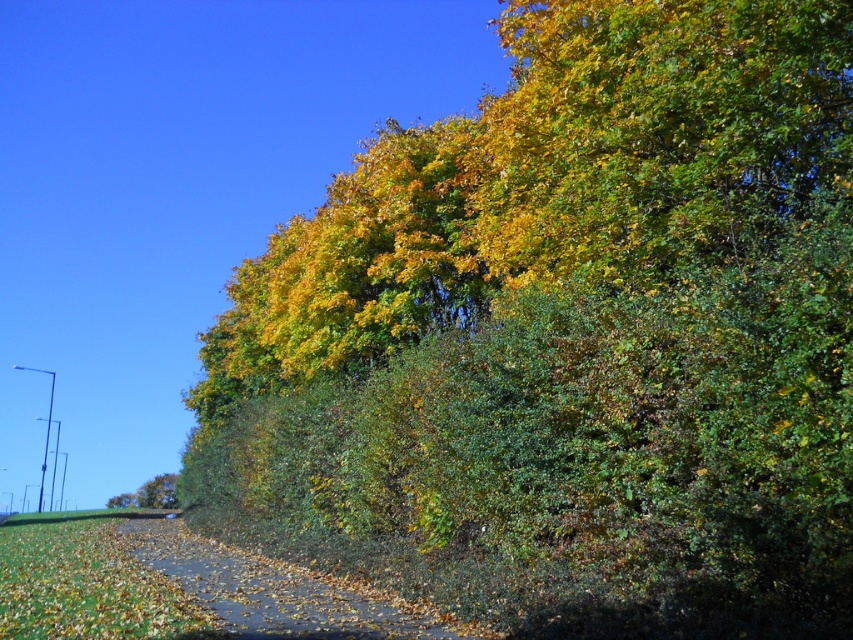
Consider the image. Is brown leafy path at lower center bigger than green leafy tree at lower left?

Indeed, brown leafy path at lower center has a larger size compared to green leafy tree at lower left.

Is point (222, 584) farther from viewer compared to point (148, 504)?

No, (222, 584) is closer to viewer.

Locate an element on the screen. This screenshot has height=640, width=853. brown leafy path at lower center is located at coordinates (271, 589).